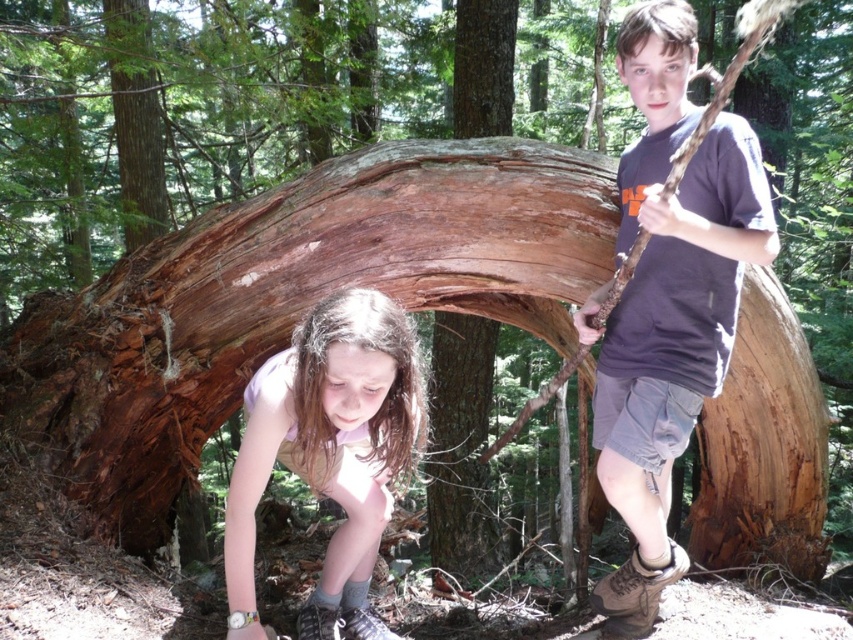
Is matte brown stick at right behind light pink fabric shirt at lower center?

Yes.

Is matte brown stick at right smaller than light pink fabric shirt at lower center?

No, matte brown stick at right is not smaller than light pink fabric shirt at lower center.

Does point (688, 374) lie behind point (366, 483)?

No.

Identify the location of matte brown stick at right. The height and width of the screenshot is (640, 853). point(668,300).